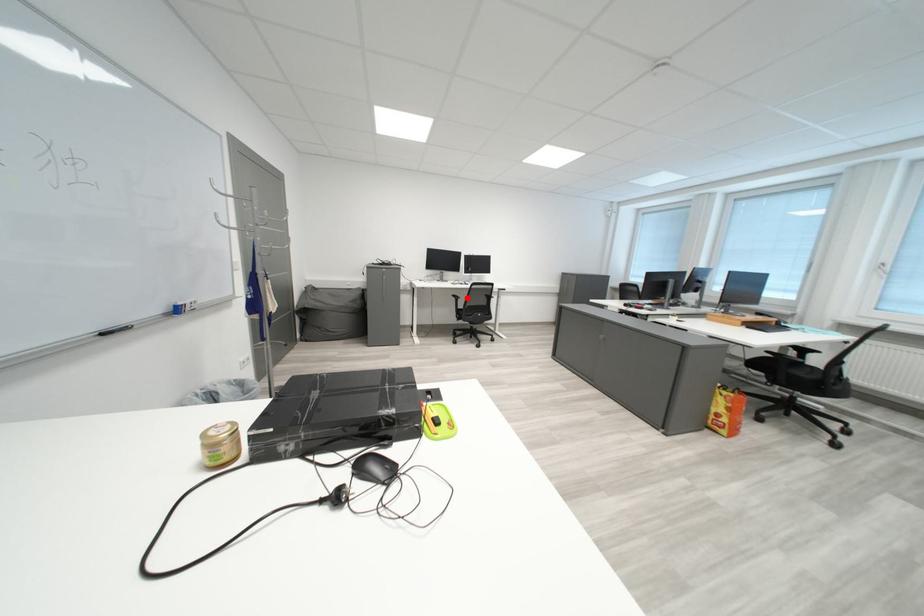
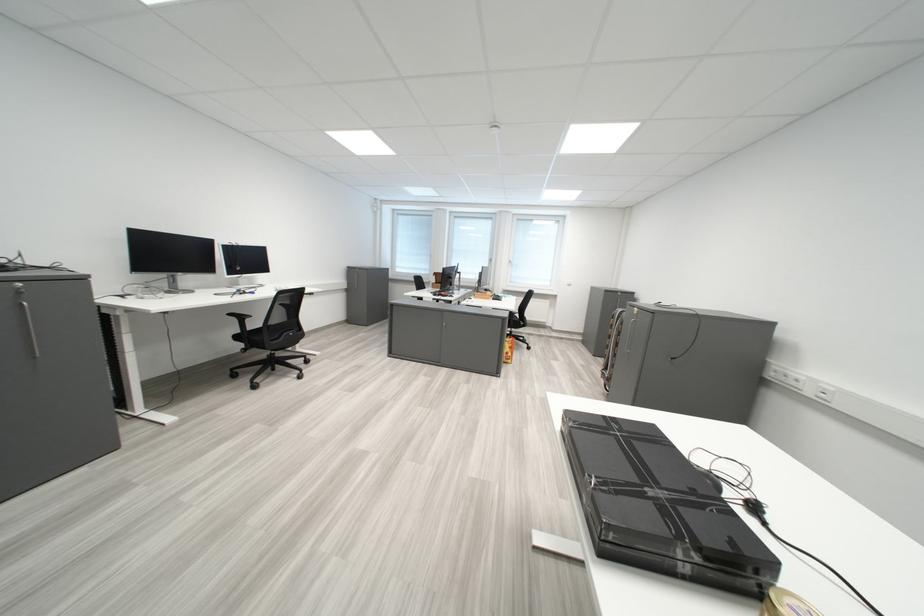
The point at the highlighted location is marked in the first image. Where is the corresponding point in the second image?

(244, 317)